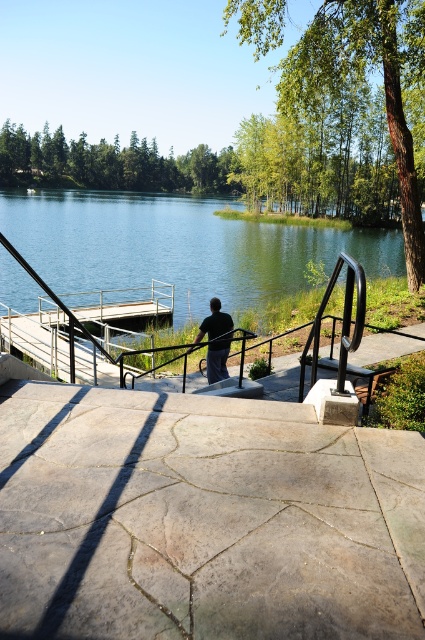
Does green water at center appear over dark gray fabric pants at center?

Indeed, green water at center is positioned over dark gray fabric pants at center.

Is point (84, 216) positioned behind point (209, 333)?

Yes.

This screenshot has width=425, height=640. I want to click on green water at center, so click(x=178, y=248).

Locate an element on the screen. green water at center is located at coordinates (178, 248).